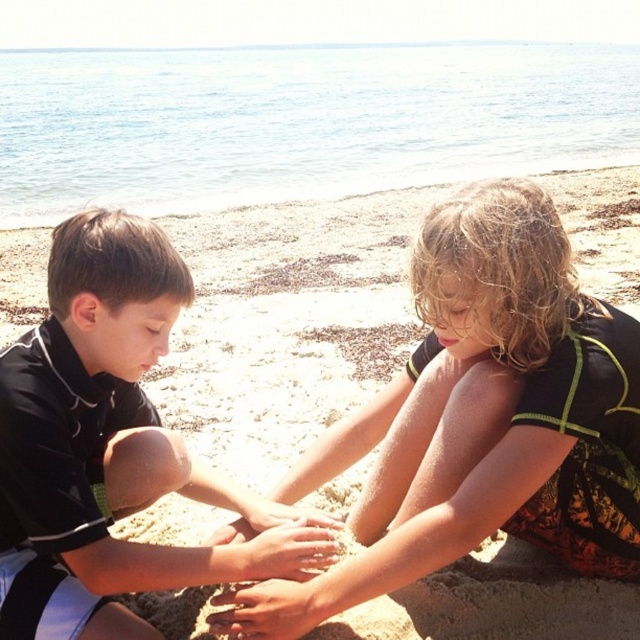
Is black matte shirt at center further to camera compared to smooth sand hands at center?

No, it is in front of smooth sand hands at center.

Does point (184, 273) lie behind point (310, 579)?

That is False.

Find the location of a particular element. black matte shirt at center is located at coordinates (112, 448).

Measure the distance from dark brown curly hair at center to smooth sand hands at center.

dark brown curly hair at center is 19.07 inches away from smooth sand hands at center.

Is point (477, 340) positioned before point (234, 627)?

That is False.

Find the location of a particular element. The height and width of the screenshot is (640, 640). dark brown curly hair at center is located at coordinates (493, 406).

Who is positioned more to the right, dark brown curly hair at center or black matte shirt at center?

From the viewer's perspective, dark brown curly hair at center appears more on the right side.

Which is in front, point (604, 516) or point (317, 561)?

Point (317, 561) is more forward.

Identify the location of dark brown curly hair at center. (493, 406).